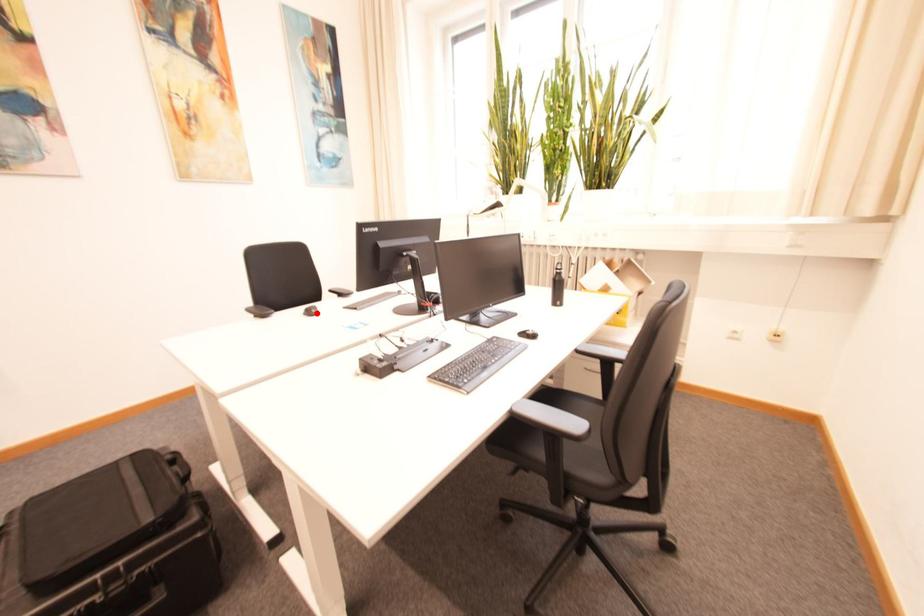
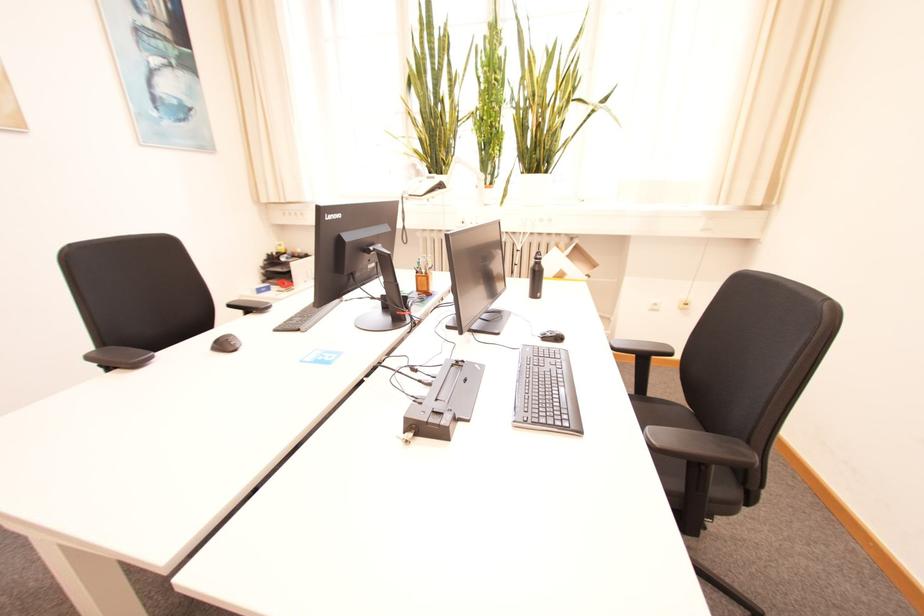
Locate, in the second image, the point that corresponds to the highlighted location in the first image.

(229, 346)